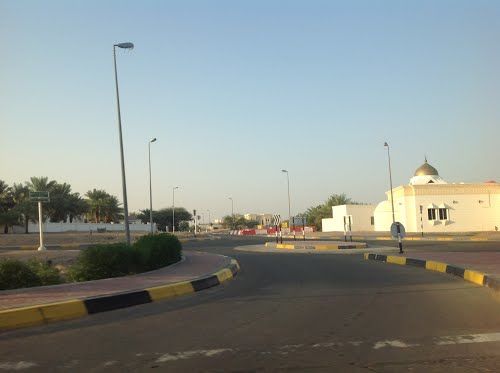
The image size is (500, 373). I want to click on yellow paint, so click(473, 276).